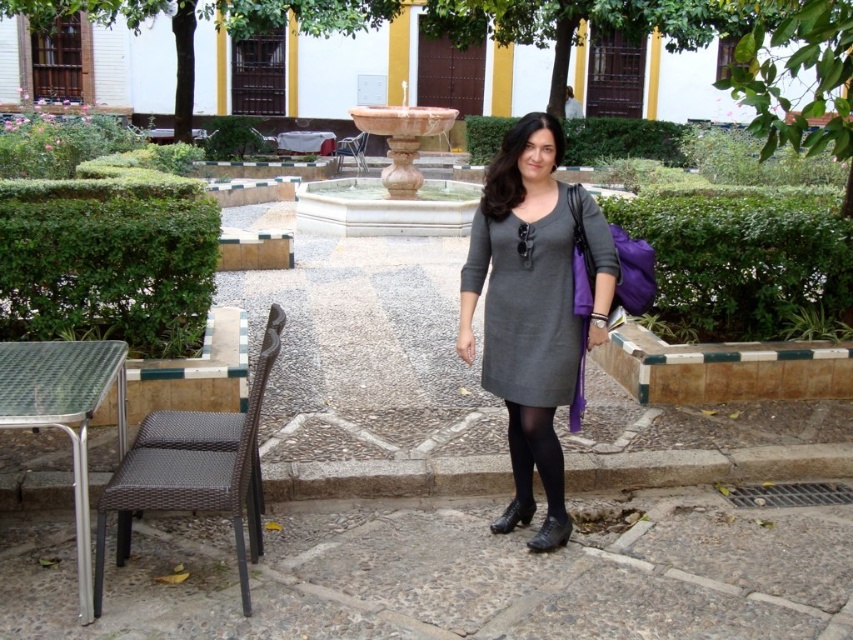
Which is below, gray matte dress at center or black tights at lower center?

Positioned lower is black tights at lower center.

Identify the location of gray matte dress at center. (526, 305).

Who is taller, gray matte dress at center or silver metallic table at lower left?

With more height is silver metallic table at lower left.

Does gray matte dress at center have a larger size compared to silver metallic table at lower left?

No.

Between point (498, 305) and point (10, 422), which one is positioned in front?

Point (10, 422)

Image resolution: width=853 pixels, height=640 pixels. In order to click on gray matte dress at center in this screenshot , I will do `click(526, 305)`.

In the scene shown: Can you confirm if brown wicker chair at lower left is thinner than black tights at lower center?

No, brown wicker chair at lower left is not thinner than black tights at lower center.

Which is more to the left, brown wicker chair at lower left or black tights at lower center?

From the viewer's perspective, brown wicker chair at lower left appears more on the left side.

What do you see at coordinates (193, 468) in the screenshot? I see `brown wicker chair at lower left` at bounding box center [193, 468].

Image resolution: width=853 pixels, height=640 pixels. I want to click on brown wicker chair at lower left, so click(x=193, y=468).